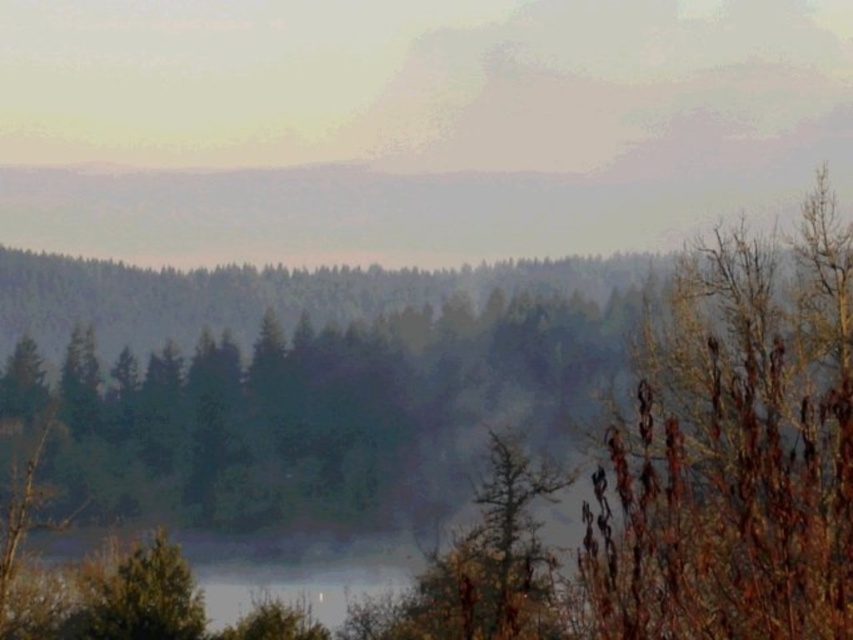
Question: Can you confirm if brown dry branches at right is thinner than green matte tree at lower left?

Choices:
 (A) yes
 (B) no

Answer: (B)

Question: Does foggy mist at upper center lie in front of green matte tree at lower left?

Choices:
 (A) no
 (B) yes

Answer: (A)

Question: Based on their relative distances, which object is farther from the foggy mist at upper center?

Choices:
 (A) green matte tree at lower left
 (B) brown dry branches at right

Answer: (B)

Question: Can you confirm if foggy mist at upper center is positioned above green matte tree at lower left?

Choices:
 (A) yes
 (B) no

Answer: (A)

Question: Which point is farther to the camera?

Choices:
 (A) (619, 605)
 (B) (526, 173)

Answer: (B)

Question: Based on their relative distances, which object is farther from the brown dry branches at right?

Choices:
 (A) foggy mist at upper center
 (B) green matte tree at lower left

Answer: (A)